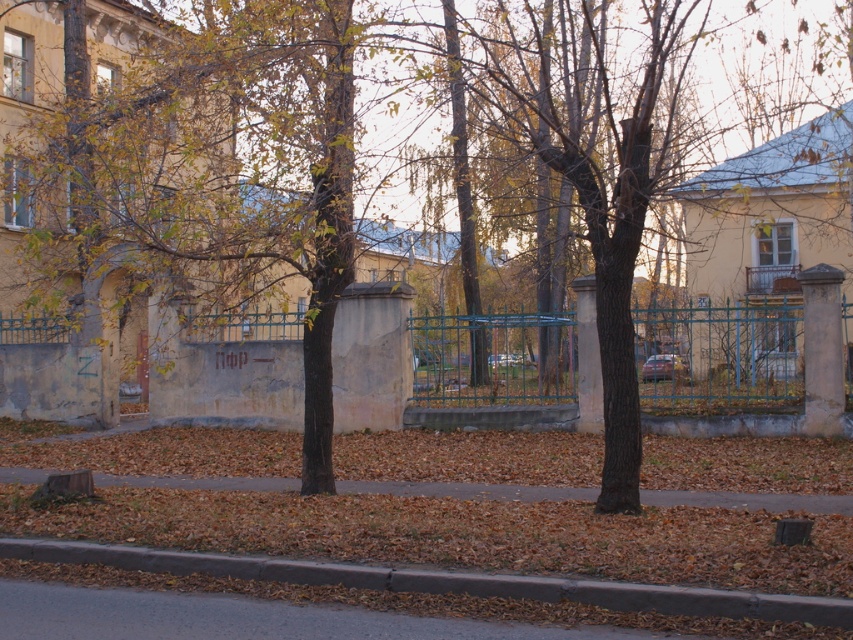
Does green leafy tree at center have a greater height compared to green metal fence at center?

Yes.

Between point (235, 209) and point (537, 355), which one is positioned behind?

The point (537, 355) is more distant.

What do you see at coordinates (234, 168) in the screenshot? I see `green leafy tree at center` at bounding box center [234, 168].

Image resolution: width=853 pixels, height=640 pixels. Identify the location of green leafy tree at center. (234, 168).

Is brown bark tree at center shorter than gray concrete curb at lower center?

In fact, brown bark tree at center may be taller than gray concrete curb at lower center.

Is brown bark tree at center to the right of gray concrete curb at lower center from the viewer's perspective?

Indeed, brown bark tree at center is positioned on the right side of gray concrete curb at lower center.

Where is `brown bark tree at center`? brown bark tree at center is located at coordinates click(595, 157).

The height and width of the screenshot is (640, 853). In order to click on brown bark tree at center in this screenshot , I will do `click(595, 157)`.

Does point (331, 58) come behind point (573, 92)?

No, it is not.

Is green leafy tree at center to the right of brown bark tree at center from the viewer's perspective?

Incorrect, green leafy tree at center is not on the right side of brown bark tree at center.

Between point (294, 141) and point (622, 193), which one is positioned in front?

Positioned in front is point (622, 193).

Find the location of a particular element. green leafy tree at center is located at coordinates (234, 168).